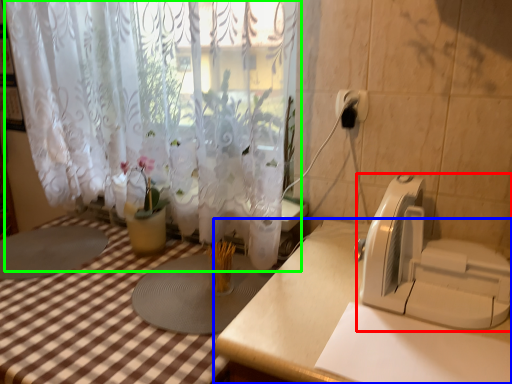
Question: Considering the real-world distances, which object is farthest from appliance (highlighted by a red box)? table (highlighted by a blue box) or curtain (highlighted by a green box)?

Choices:
 (A) table
 (B) curtain

Answer: (B)